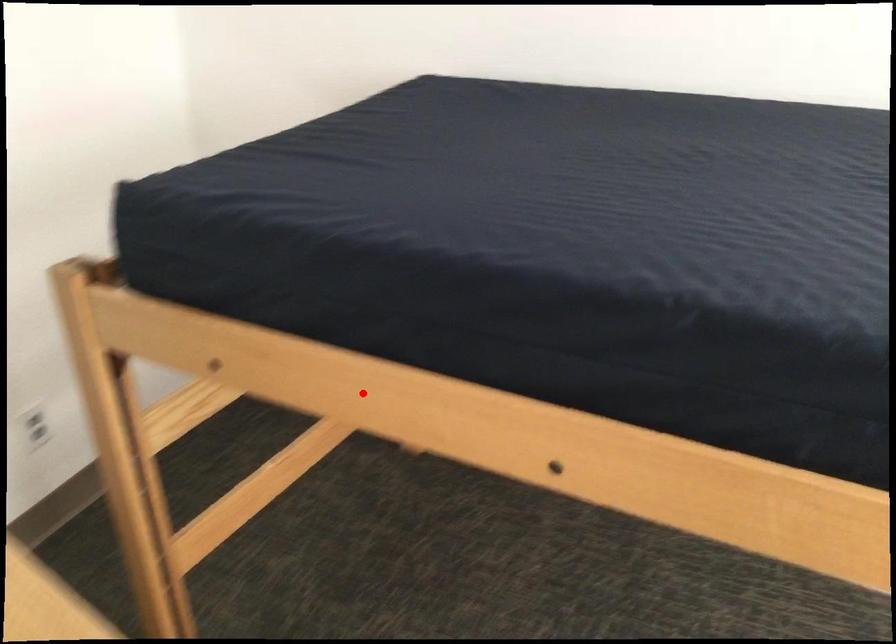
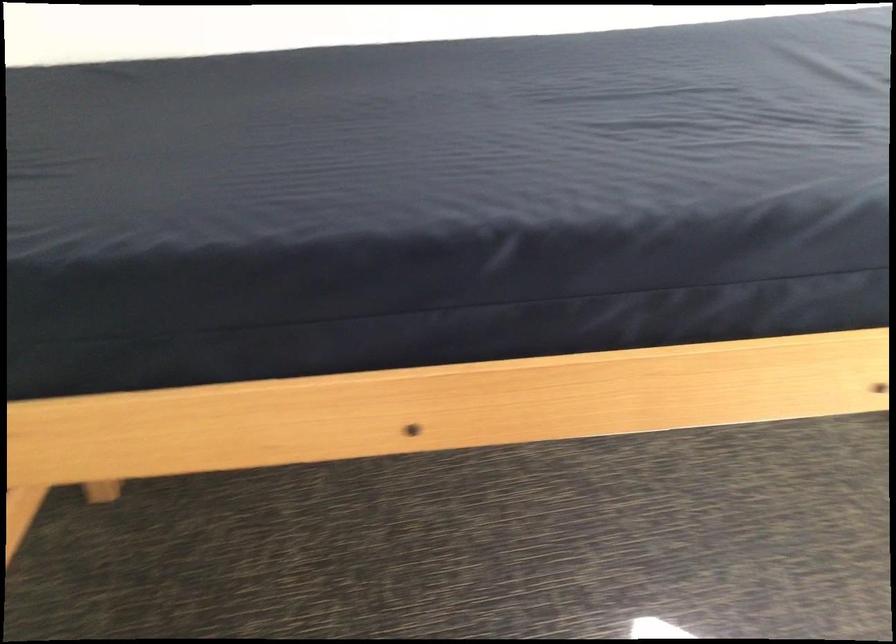
The point at the highlighted location is marked in the first image. Where is the corresponding point in the second image?

(165, 436)